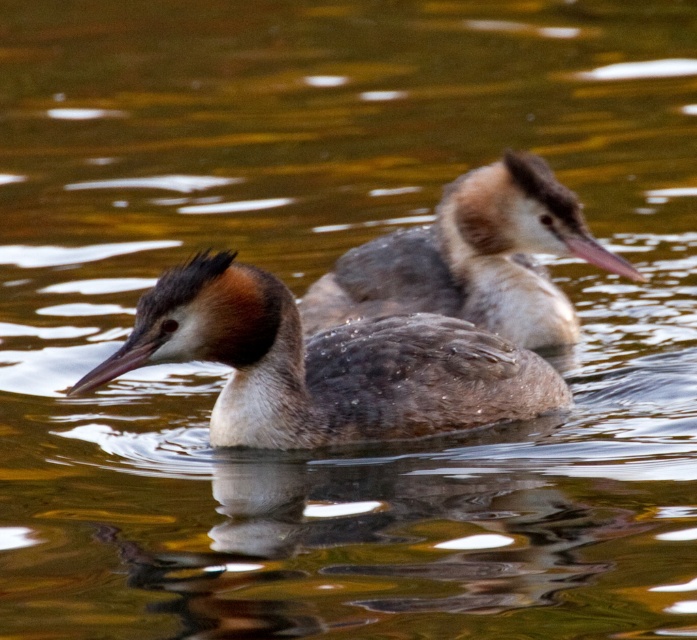
You are a wildlife photographer aiming to capture a closeup shot of the brown matte duck at left and the brown matte duck at upper center. Given that your camera can only focus on one duck at a time, which duck should you focus on to ensure the subject fills the frame adequately?

The brown matte duck at left is bigger than the brown matte duck at upper center, so focusing on the brown matte duck at left will ensure the subject fills the frame adequately.

You are a wildlife photographer trying to capture a photo of both brown matte duck at left and brown matte duck at upper center. You want to ensure that both birds are fully visible in your shot. Based on their sizes, which duck might require more space in the frame?

The brown matte duck at left might require more space in the frame since it is wider than the brown matte duck at upper center.